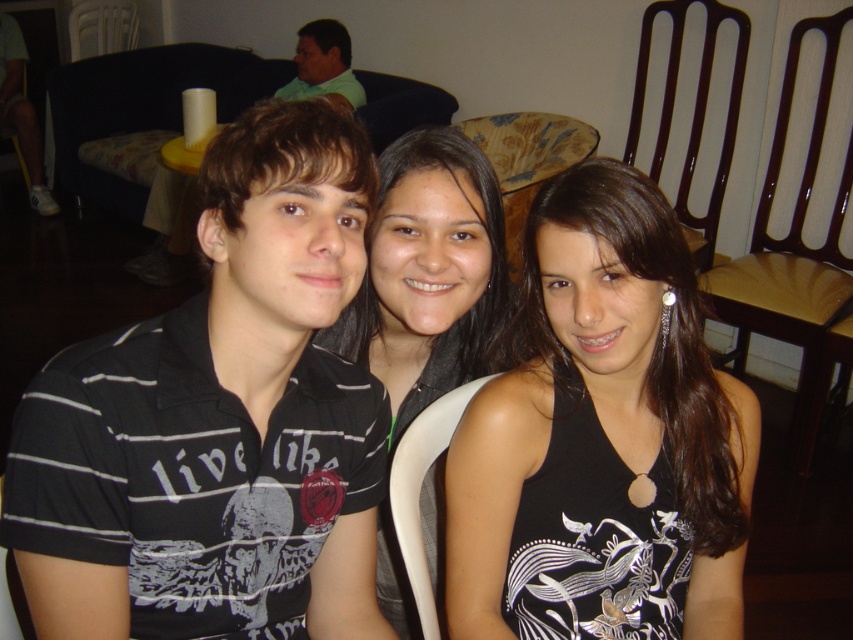
In the scene shown: You are standing in the room and want to move from the point at coordinates point (x=310, y=362) to the point at coordinates point (x=334, y=97). Which direction should you move?

You should move to the left because point (x=310, y=362) is to the right of point (x=334, y=97).

In the scene shown: You are standing in front of the three people in the image. There is a point at coordinate [218,420]. Which person is this point located on?

The point at coordinate [218,420] is located on the black striped polo shirt at left.

You are standing in the room where the three people are sitting. You want to walk from point A to point B. Point A is at coordinate point[521,179] and point B is at coordinate point[16,88]. Which direction should you move to go from point A to point B?

Result: To move from point A at coordinate point[521,179] to point B at coordinate point[16,88], you should move downward and to the left since point A is in front of point B.